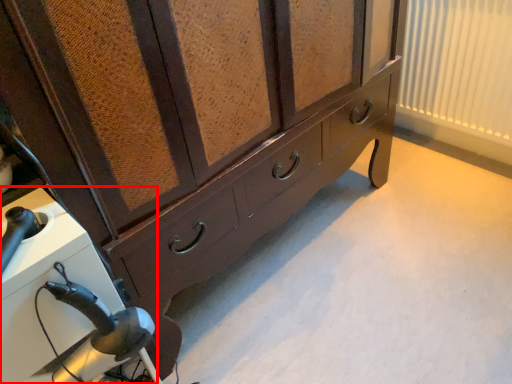
Question: From the image's perspective, what is the correct spatial relationship of appliance (annotated by the red box) in relation to curtain?

Choices:
 (A) above
 (B) below

Answer: (B)